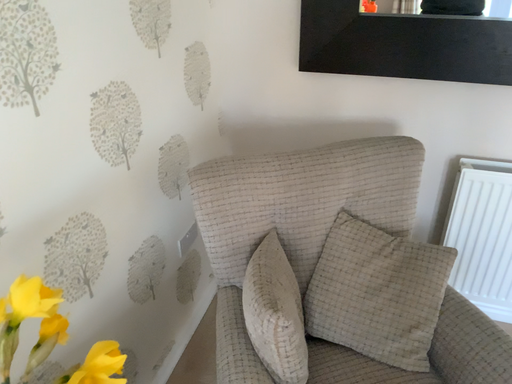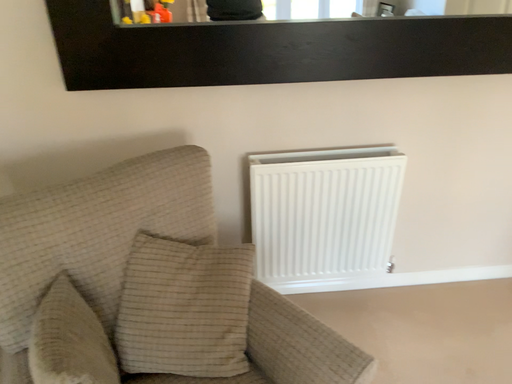
Question: Which way did the camera rotate in the video?

Choices:
 (A) rotated right
 (B) rotated left

Answer: (A)